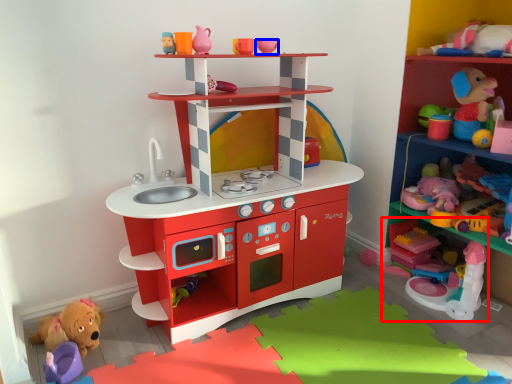
Question: Which object is further to the camera taking this photo, toy (highlighted by a red box) or toy (highlighted by a blue box)?

Choices:
 (A) toy
 (B) toy

Answer: (A)